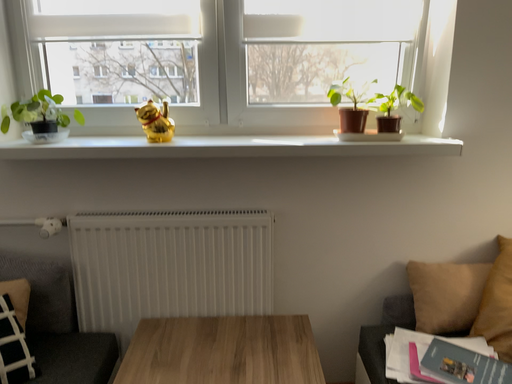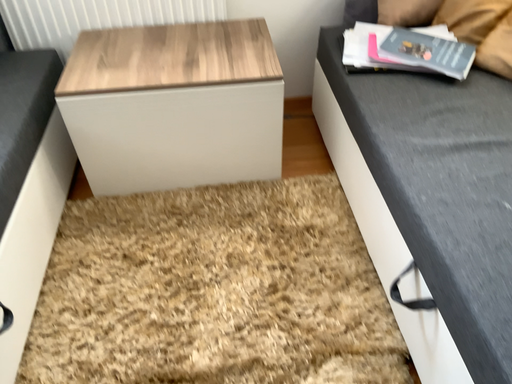
Question: How did the camera likely rotate when shooting the video?

Choices:
 (A) rotated downward
 (B) rotated upward

Answer: (A)